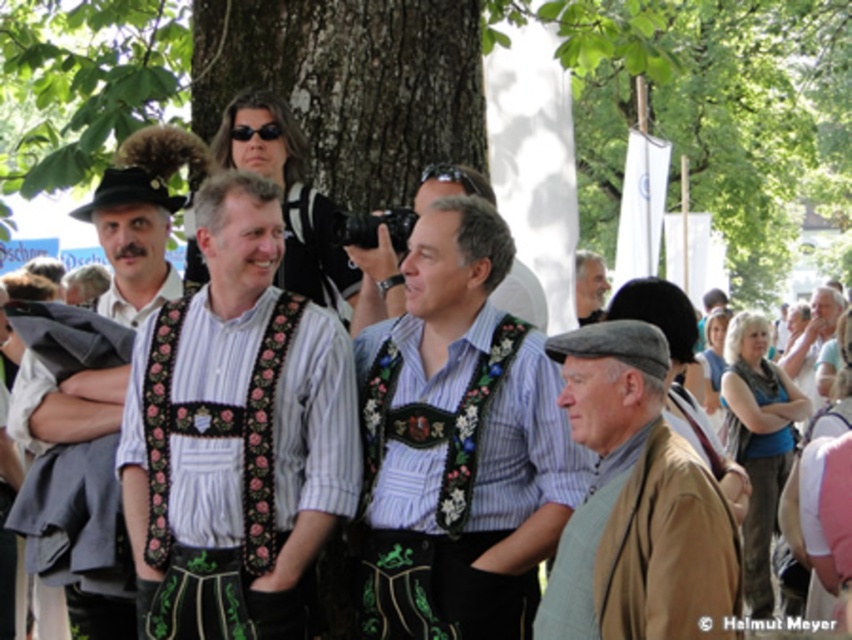
You are a photographer at the festival and want to capture both the embroidered fabric vest at center and the gray woolen hat at upper right in the same frame. Based on their positions, which object should you focus on first to ensure both are in the shot?

The embroidered fabric vest at center is to the left of the gray woolen hat at upper right, so focusing on the embroidered fabric vest at center first would help ensure both are in the frame since it is positioned to the left of the hat.

You are a photographer trying to capture a detailed shot of both the embroidered fabric vest at center and the gray woolen hat at upper right. Since you want both items in focus, you need to adjust your camera settings. Which object should you focus on first to ensure both are sharp in the photo?

The embroidered fabric vest at center is closer to the viewer than the gray woolen hat at upper right. To ensure both are in focus, you should focus on the gray woolen hat at upper right first, as focusing on the farther object allows the closer one to also be in focus within the depth of field.

You are a photographer at the festival and want to capture both the striped fabric shirt at center and the gray woolen hat at upper right in the same frame. Which object should you focus on first to ensure both are in the shot?

The striped fabric shirt at center is above the gray woolen hat at upper right, so you should focus on the striped fabric shirt at center first to ensure both are in the shot.